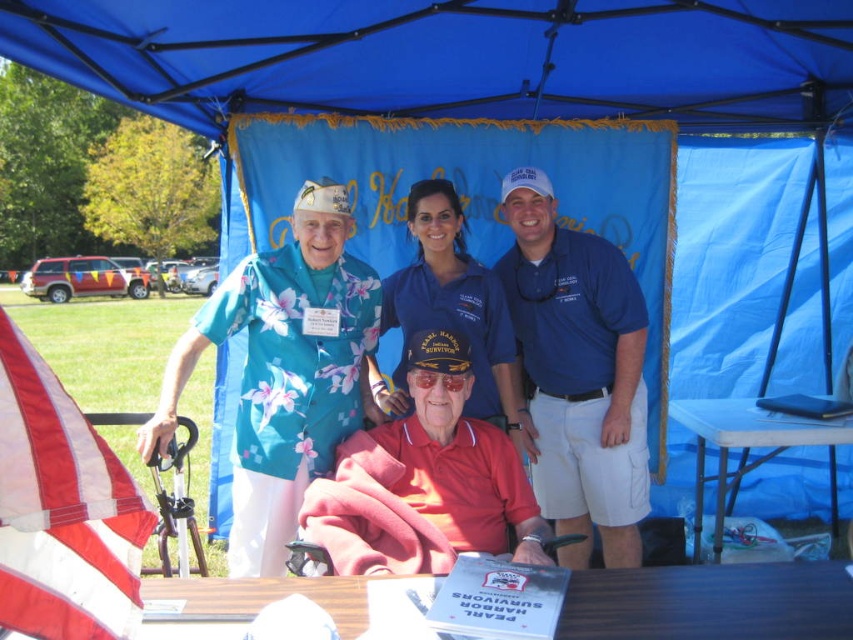
Question: Estimate the real-world distances between objects in this image. Which object is closer to the red fabric flag at lower left?

Choices:
 (A) red matte shirt at center
 (B) wooden table at lower center
 (C) blue plastic table at lower right
 (D) blue cotton polo shirt at center

Answer: (A)

Question: Considering the real-world distances, which object is farthest from the teal floral shirt at left?

Choices:
 (A) blue cotton polo shirt at center
 (B) red matte shirt at center
 (C) wooden table at lower center
 (D) red fabric flag at lower left

Answer: (C)

Question: Considering the relative positions of red matte shirt at center and red fabric flag at lower left in the image provided, where is red matte shirt at center located with respect to red fabric flag at lower left?

Choices:
 (A) left
 (B) right

Answer: (B)

Question: Which point is farther to the camera?

Choices:
 (A) red fabric flag at lower left
 (B) blue fabric canopy at upper center

Answer: (B)

Question: Does blue cotton polo shirt at center lie in front of red fabric flag at lower left?

Choices:
 (A) yes
 (B) no

Answer: (B)

Question: Does teal floral shirt at left appear under wooden table at lower center?

Choices:
 (A) yes
 (B) no

Answer: (B)